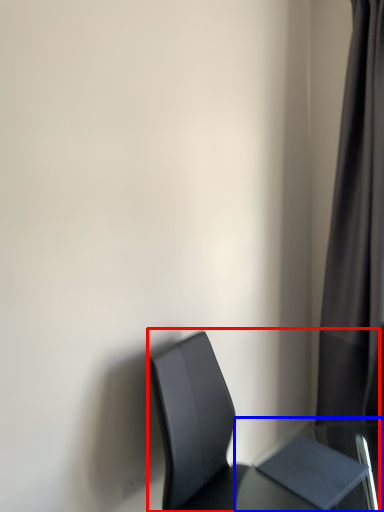
Question: Which point is closer to the camera, chair (highlighted by a red box) or table (highlighted by a blue box)?

Choices:
 (A) chair
 (B) table

Answer: (A)